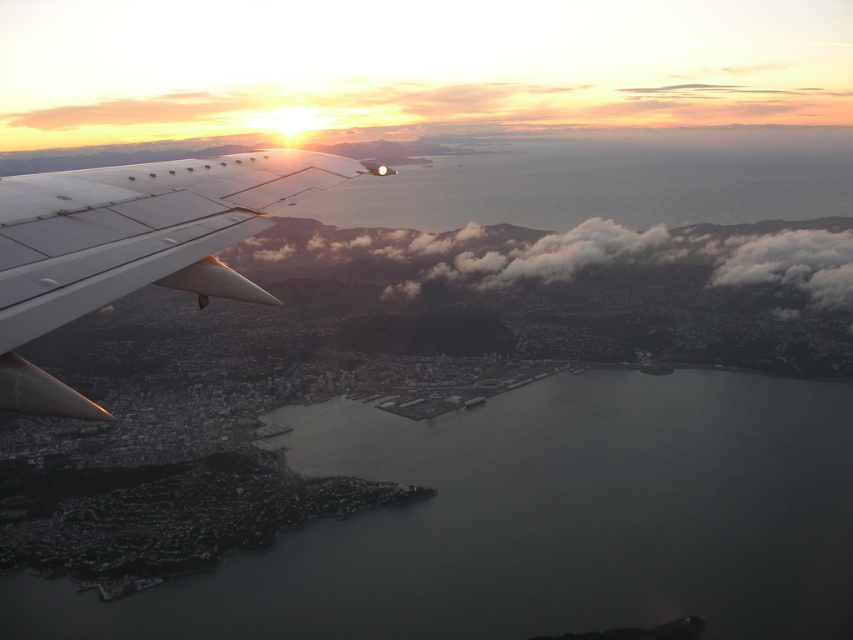
Does dark gray water at lower center have a greater width compared to metallic gray wing at left?

Yes.

Between point (824, 536) and point (48, 212), which one is positioned in front?

Point (48, 212) is in front.

This screenshot has height=640, width=853. What are the coordinates of `dark gray water at lower center` in the screenshot? It's located at (532, 522).

Can you confirm if metallic gray wing at left is bigger than white fluffy clouds at center?

Incorrect, metallic gray wing at left is not larger than white fluffy clouds at center.

Between metallic gray wing at left and white fluffy clouds at center, which one appears on the right side from the viewer's perspective?

white fluffy clouds at center is more to the right.

Does point (78, 275) lie in front of point (498, 225)?

Yes, point (78, 275) is in front of point (498, 225).

Identify the location of metallic gray wing at left. Image resolution: width=853 pixels, height=640 pixels. point(132,244).

Does dark gray water at lower center lie behind white fluffy clouds at center?

Yes, dark gray water at lower center is further from the viewer.

Which is behind, point (393, 426) or point (421, 285)?

Point (393, 426)

This screenshot has height=640, width=853. In order to click on dark gray water at lower center in this screenshot , I will do `click(532, 522)`.